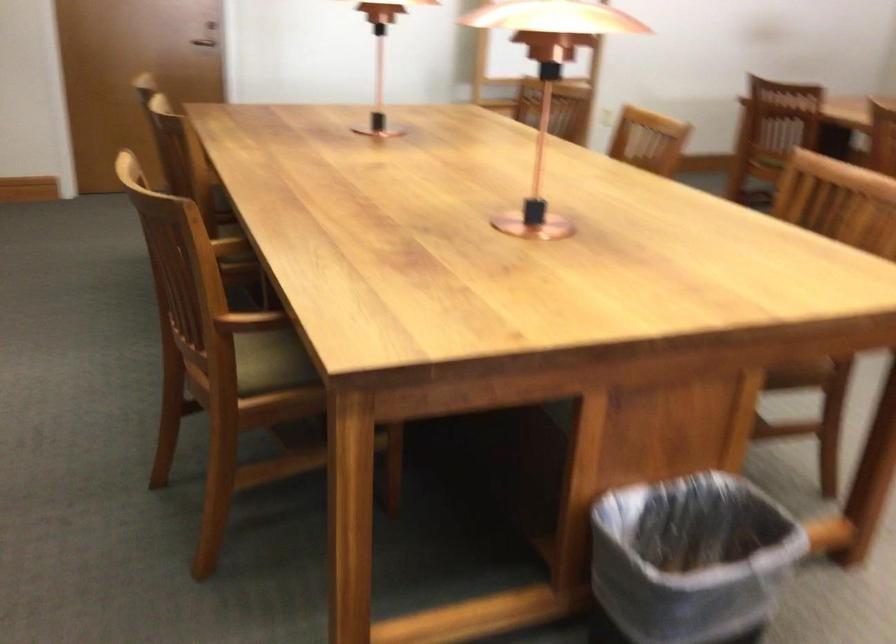
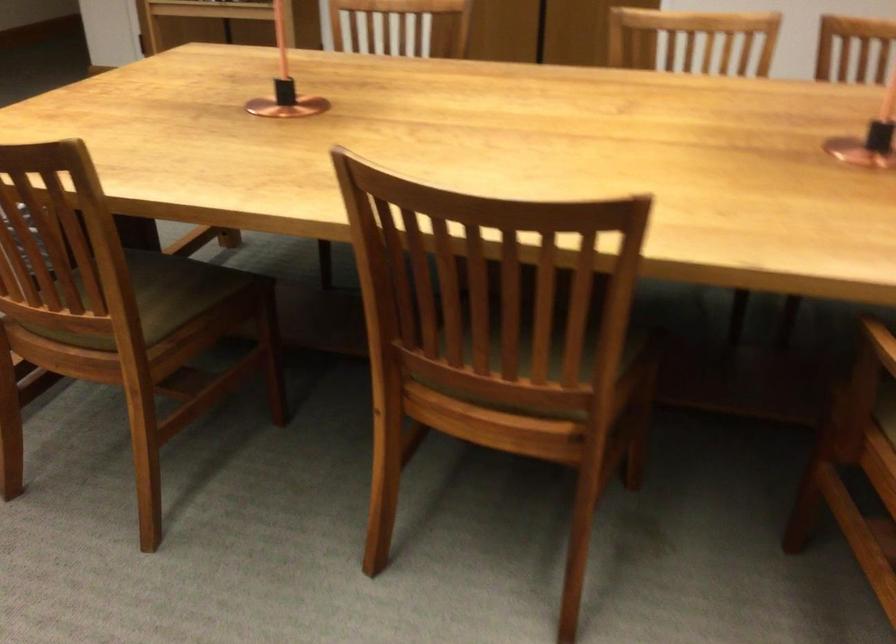
Question: I am providing you with two images of the same scene from different viewpoints. Which of the following objects are not visible in image2?

Choices:
 (A) copper table object
 (B) green chair sitting surface
 (C) wooden chair armrest
 (D) lamp floor switch

Answer: (C)